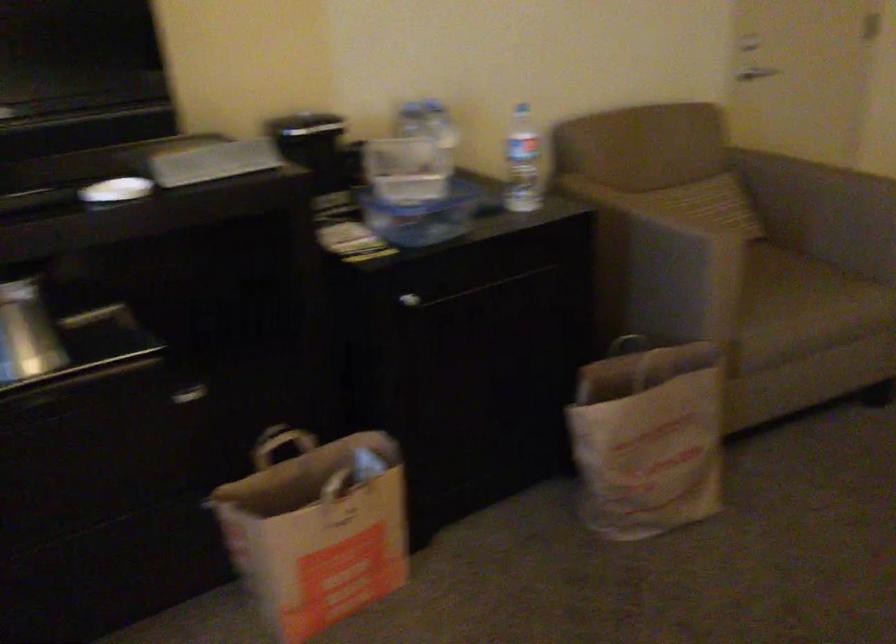
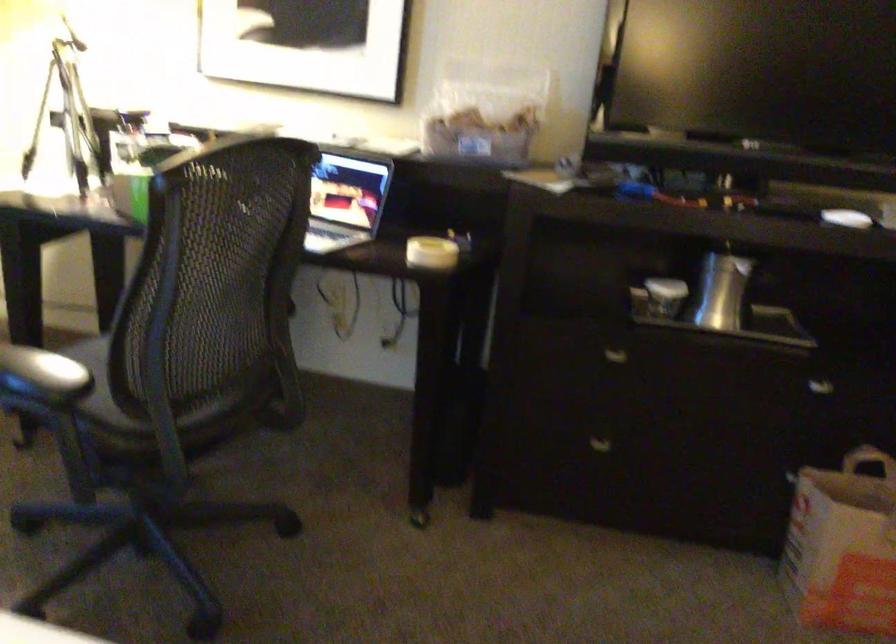
In the second image, find the point that corresponds to point (195, 401) in the first image.

(821, 389)